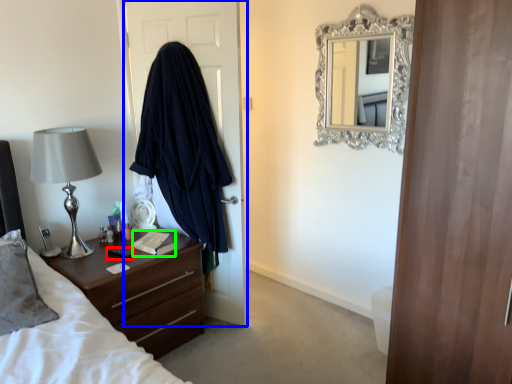
Question: Which object is positioned farthest from remote control (highlighted by a red box)? Select from door (highlighted by a blue box) and book (highlighted by a green box).

Choices:
 (A) door
 (B) book

Answer: (A)